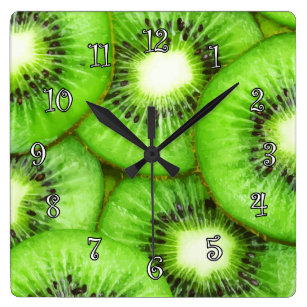
Identify the location of the second hand of clock. Image resolution: width=307 pixels, height=307 pixels. (154, 209), (149, 184).